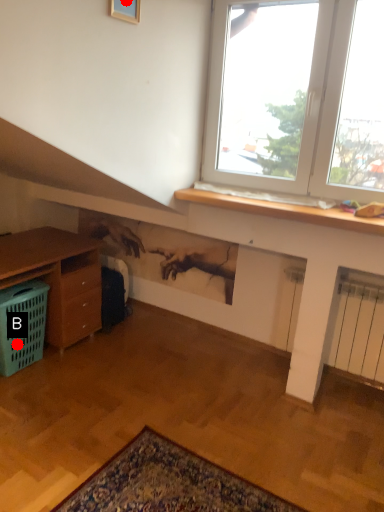
Question: Two points are circled on the image, labeled by A and B beside each circle. Among these points, which one is farthest from the camera?

Choices:
 (A) A is further
 (B) B is further

Answer: (B)